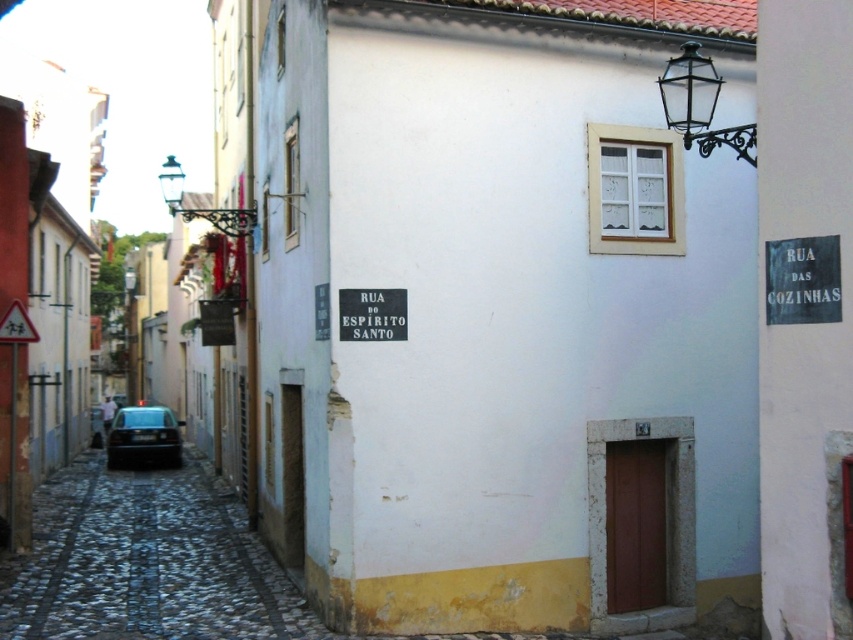
Which is more to the left, dark gray metallic car at lower left or yellow plastic triangle at upper left?

Positioned to the left is dark gray metallic car at lower left.

Is point (146, 422) farther from camera compared to point (27, 324)?

Yes, it is.

Identify the location of dark gray metallic car at lower left. (143, 436).

Describe the element at coordinates (699, 104) in the screenshot. I see `black wrought iron lantern at upper right` at that location.

Which is more to the left, black wrought iron lantern at upper right or dark gray metallic car at lower left?

dark gray metallic car at lower left is more to the left.

This screenshot has width=853, height=640. I want to click on black wrought iron lantern at upper right, so click(x=699, y=104).

Is dark gray metallic car at lower left above metallic streetlamp at upper left?

Incorrect, dark gray metallic car at lower left is not positioned above metallic streetlamp at upper left.

Can you confirm if dark gray metallic car at lower left is bigger than metallic streetlamp at upper left?

No, dark gray metallic car at lower left is not bigger than metallic streetlamp at upper left.

This screenshot has height=640, width=853. What do you see at coordinates (143, 436) in the screenshot? I see `dark gray metallic car at lower left` at bounding box center [143, 436].

Where is `dark gray metallic car at lower left`? dark gray metallic car at lower left is located at coordinates (143, 436).